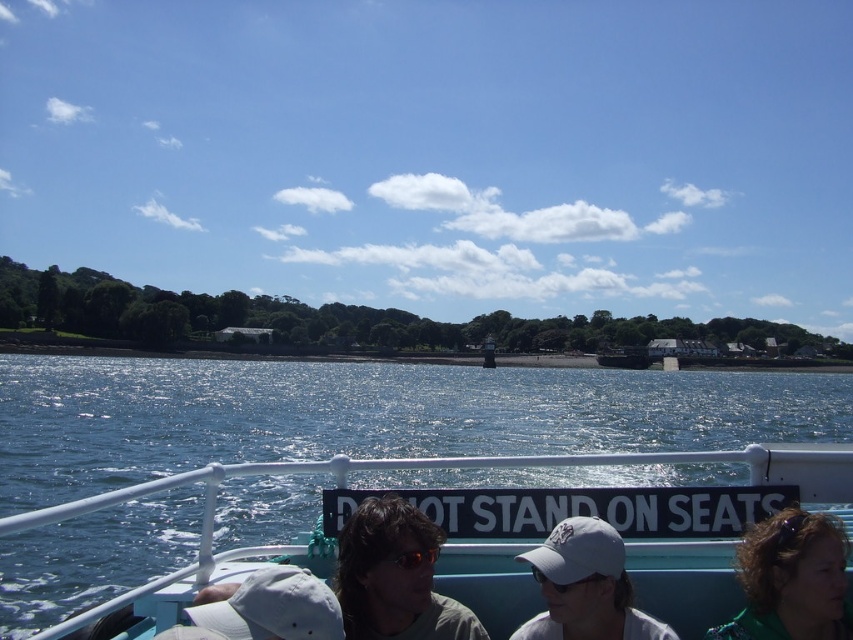
Question: Does blue plastic boat at center have a greater width compared to white matte baseball cap at lower center?

Choices:
 (A) yes
 (B) no

Answer: (A)

Question: Which of the following is the closest to the observer?

Choices:
 (A) (808, 548)
 (B) (577, 620)

Answer: (A)

Question: Which of these objects is positioned farthest from the blue plastic boat at center?

Choices:
 (A) white matte baseball cap at center
 (B) green fabric jacket at lower right
 (C) matte gray sunglasses at center
 (D) white matte baseball cap at lower center

Answer: (D)

Question: Can you confirm if green fabric jacket at lower right is thinner than white matte baseball cap at lower center?

Choices:
 (A) yes
 (B) no

Answer: (B)

Question: Which point is closer to the camera taking this photo?

Choices:
 (A) (643, 620)
 (B) (231, 556)
 (C) (444, 595)
 (D) (827, 576)

Answer: (D)

Question: Does blue plastic boat at center lie behind white matte baseball cap at lower center?

Choices:
 (A) no
 (B) yes

Answer: (B)